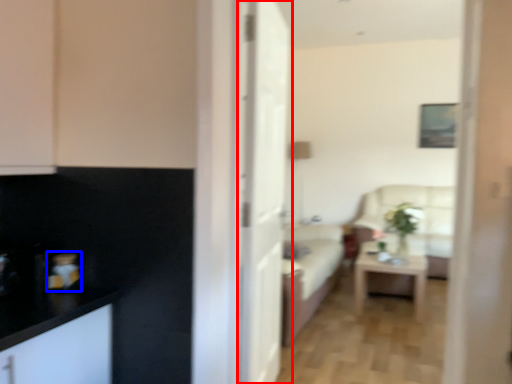
Question: Which object appears farthest to the camera in this image, door (highlighted by a red box) or appliance (highlighted by a blue box)?

Choices:
 (A) door
 (B) appliance

Answer: (A)